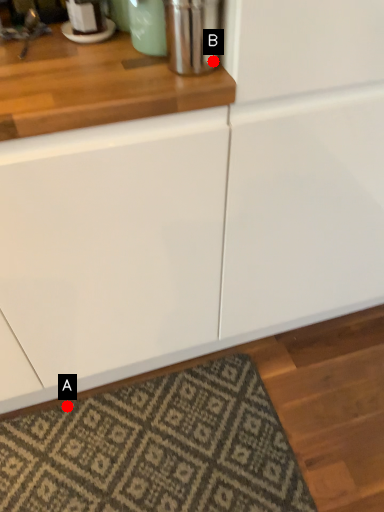
Question: Two points are circled on the image, labeled by A and B beside each circle. Which point is further to the camera?

Choices:
 (A) A is further
 (B) B is further

Answer: (A)